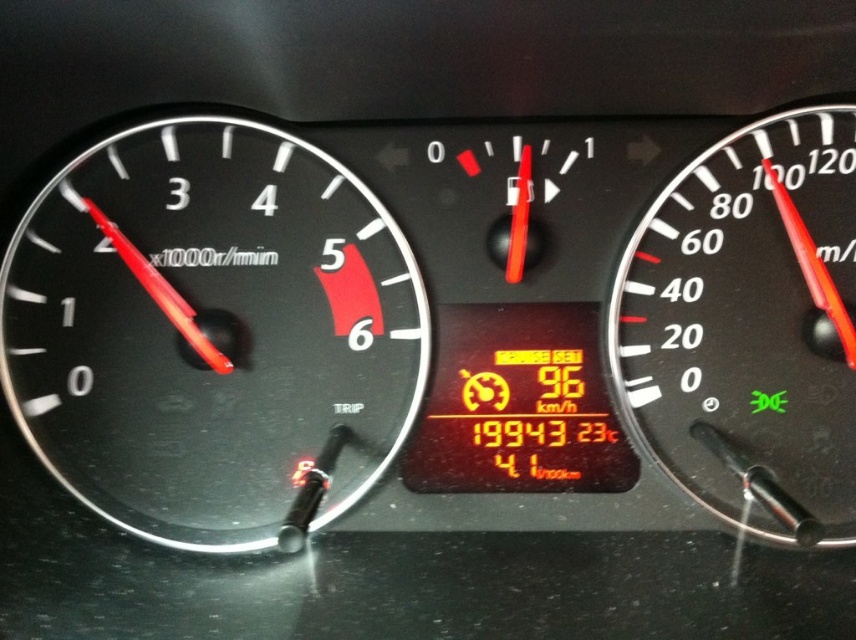
Who is more distant from viewer, (244, 285) or (843, 145)?

Point (244, 285)

Can you confirm if black matte speedometer at left is positioned above black plastic speedometer at right?

Indeed, black matte speedometer at left is positioned over black plastic speedometer at right.

Describe the element at coordinates (214, 333) in the screenshot. I see `black matte speedometer at left` at that location.

Identify the location of black matte speedometer at left. The height and width of the screenshot is (640, 856). pyautogui.click(x=214, y=333).